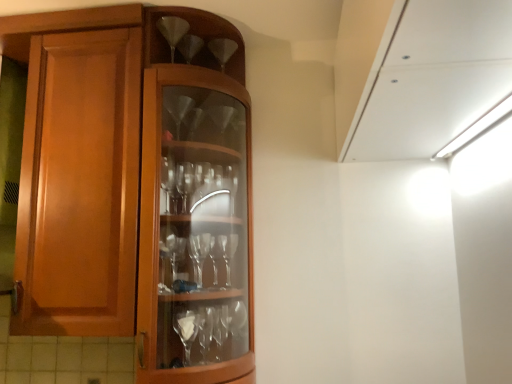
You are a GUI agent. You are given a task and a screenshot of the screen. Output one action in this format:
    pyautogui.click(x=<x>, y=<y>)
    Task: Click on the clear glass wine glass at upper center, the first wine glass positioned from the front
    This screenshot has height=384, width=512.
    Given the screenshot: What is the action you would take?
    pyautogui.click(x=172, y=30)

The width and height of the screenshot is (512, 384). What do you see at coordinates (172, 30) in the screenshot? I see `clear glass wine glass at upper center, the second wine glass when ordered from back to front` at bounding box center [172, 30].

Describe the element at coordinates (222, 50) in the screenshot. I see `clear glass wine glass at upper center, acting as the second wine glass starting from the front` at that location.

Identify the location of clear glass wine glass at upper center, acting as the second wine glass starting from the front. (222, 50).

Identify the location of clear glass wine glass at upper center, the first wine glass positioned from the front. (172, 30).

Which object is positioned more to the right, clear glass wine glass at upper center, which ranks as the first wine glass in back-to-front order, or clear glass wine glass at upper center, the first wine glass positioned from the front?

clear glass wine glass at upper center, which ranks as the first wine glass in back-to-front order.

From the picture: Does clear glass wine glass at upper center, positioned as the second wine glass in left-to-right order, come in front of clear glass wine glass at upper center, the second wine glass when ordered from back to front?

That is False.

Is point (226, 39) in front of point (175, 30)?

That is False.

From the image's perspective, which is above, clear glass wine glass at upper center, positioned as the second wine glass in left-to-right order, or clear glass wine glass at upper center, placed as the 1th wine glass when sorted from left to right?

clear glass wine glass at upper center, placed as the 1th wine glass when sorted from left to right, from the image's perspective.

From a real-world perspective, is clear glass wine glass at upper center, the first wine glass viewed from the right, located beneath clear glass wine glass at upper center, which appears as the second wine glass when viewed from the right?

Yes, from a real-world perspective, clear glass wine glass at upper center, the first wine glass viewed from the right, is below clear glass wine glass at upper center, which appears as the second wine glass when viewed from the right.

Is clear glass wine glass at upper center, which ranks as the first wine glass in back-to-front order, thinner than clear glass wine glass at upper center, the second wine glass when ordered from back to front?

Incorrect, the width of clear glass wine glass at upper center, which ranks as the first wine glass in back-to-front order, is not less than that of clear glass wine glass at upper center, the second wine glass when ordered from back to front.

Does clear glass wine glass at upper center, the first wine glass viewed from the right, have a lesser height compared to clear glass wine glass at upper center, the second wine glass when ordered from back to front?

In fact, clear glass wine glass at upper center, the first wine glass viewed from the right, may be taller than clear glass wine glass at upper center, the second wine glass when ordered from back to front.

Does clear glass wine glass at upper center, positioned as the second wine glass in left-to-right order, have a larger size compared to clear glass wine glass at upper center, placed as the 1th wine glass when sorted from left to right?

Yes.

Which is correct: clear glass wine glass at upper center, positioned as the second wine glass in left-to-right order, is inside clear glass wine glass at upper center, the first wine glass positioned from the front, or outside of it?

The correct answer is: outside.

Is clear glass wine glass at upper center, acting as the second wine glass starting from the front, far away from clear glass wine glass at upper center, placed as the 1th wine glass when sorted from left to right?

That's not correct — clear glass wine glass at upper center, acting as the second wine glass starting from the front, is a little close to clear glass wine glass at upper center, placed as the 1th wine glass when sorted from left to right.

Is clear glass wine glass at upper center, which appears as the second wine glass when viewed from the right, at the back of clear glass wine glass at upper center, which ranks as the first wine glass in back-to-front order?

No.

What's the angular difference between clear glass wine glass at upper center, acting as the second wine glass starting from the front, and clear glass wine glass at upper center, which appears as the second wine glass when viewed from the right,'s facing directions?

0.00119 degrees separate the facing orientations of clear glass wine glass at upper center, acting as the second wine glass starting from the front, and clear glass wine glass at upper center, which appears as the second wine glass when viewed from the right.

At what (x,y) coordinates should I click in order to perform the action: click on wine glass behind the clear glass wine glass at upper center, placed as the 1th wine glass when sorted from left to right. Please return your answer as a coordinate pair (x, y). The image size is (512, 384). Looking at the image, I should click on (222, 50).

Can you confirm if clear glass wine glass at upper center, placed as the 1th wine glass when sorted from left to right, is positioned to the left of clear glass wine glass at upper center, positioned as the second wine glass in left-to-right order?

Yes, clear glass wine glass at upper center, placed as the 1th wine glass when sorted from left to right, is to the left of clear glass wine glass at upper center, positioned as the second wine glass in left-to-right order.

Is clear glass wine glass at upper center, placed as the 1th wine glass when sorted from left to right, behind clear glass wine glass at upper center, positioned as the second wine glass in left-to-right order?

No, it is in front of clear glass wine glass at upper center, positioned as the second wine glass in left-to-right order.

Does point (180, 37) come behind point (220, 63)?

No, it is in front of (220, 63).

From the image's perspective, who appears lower, clear glass wine glass at upper center, which appears as the second wine glass when viewed from the right, or clear glass wine glass at upper center, which ranks as the first wine glass in back-to-front order?

clear glass wine glass at upper center, which ranks as the first wine glass in back-to-front order, is shown below in the image.

From a real-world perspective, between clear glass wine glass at upper center, which appears as the second wine glass when viewed from the right, and clear glass wine glass at upper center, positioned as the second wine glass in left-to-right order, who is vertically higher?

Result: In real-world perspective, clear glass wine glass at upper center, which appears as the second wine glass when viewed from the right, is above.

Considering the relative sizes of clear glass wine glass at upper center, the second wine glass when ordered from back to front, and clear glass wine glass at upper center, which ranks as the first wine glass in back-to-front order, in the image provided, is clear glass wine glass at upper center, the second wine glass when ordered from back to front, wider than clear glass wine glass at upper center, which ranks as the first wine glass in back-to-front order,?

No, clear glass wine glass at upper center, the second wine glass when ordered from back to front, is not wider than clear glass wine glass at upper center, which ranks as the first wine glass in back-to-front order.

Considering the sizes of objects clear glass wine glass at upper center, placed as the 1th wine glass when sorted from left to right, and clear glass wine glass at upper center, acting as the second wine glass starting from the front, in the image provided, who is shorter, clear glass wine glass at upper center, placed as the 1th wine glass when sorted from left to right, or clear glass wine glass at upper center, acting as the second wine glass starting from the front,?

Standing shorter between the two is clear glass wine glass at upper center, acting as the second wine glass starting from the front.

Who is smaller, clear glass wine glass at upper center, placed as the 1th wine glass when sorted from left to right, or clear glass wine glass at upper center, positioned as the second wine glass in left-to-right order?

Smaller between the two is clear glass wine glass at upper center, placed as the 1th wine glass when sorted from left to right.

Is clear glass wine glass at upper center, which appears as the second wine glass when viewed from the right, completely or partially outside of clear glass wine glass at upper center, which ranks as the first wine glass in back-to-front order?

clear glass wine glass at upper center, which appears as the second wine glass when viewed from the right, lies outside clear glass wine glass at upper center, which ranks as the first wine glass in back-to-front order,'s area.

Is clear glass wine glass at upper center, which appears as the second wine glass when viewed from the right, positioned far away from clear glass wine glass at upper center, acting as the second wine glass starting from the front?

Actually, clear glass wine glass at upper center, which appears as the second wine glass when viewed from the right, and clear glass wine glass at upper center, acting as the second wine glass starting from the front, are a little close together.

Could you tell me if clear glass wine glass at upper center, which appears as the second wine glass when viewed from the right, is facing clear glass wine glass at upper center, which ranks as the first wine glass in back-to-front order?

No, clear glass wine glass at upper center, which appears as the second wine glass when viewed from the right, is not turned towards clear glass wine glass at upper center, which ranks as the first wine glass in back-to-front order.

How much distance is there between clear glass wine glass at upper center, the first wine glass positioned from the front, and clear glass wine glass at upper center, positioned as the second wine glass in left-to-right order?

A distance of 6.47 inches exists between clear glass wine glass at upper center, the first wine glass positioned from the front, and clear glass wine glass at upper center, positioned as the second wine glass in left-to-right order.

The width and height of the screenshot is (512, 384). I want to click on wine glass below the clear glass wine glass at upper center, placed as the 1th wine glass when sorted from left to right (from the image's perspective), so click(222, 50).

Locate an element on the screen. This screenshot has height=384, width=512. wine glass that appears above the clear glass wine glass at upper center, the first wine glass viewed from the right (from the image's perspective) is located at coordinates (172, 30).

Locate an element on the screen. The height and width of the screenshot is (384, 512). wine glass that appears on the right of clear glass wine glass at upper center, the first wine glass positioned from the front is located at coordinates (222, 50).